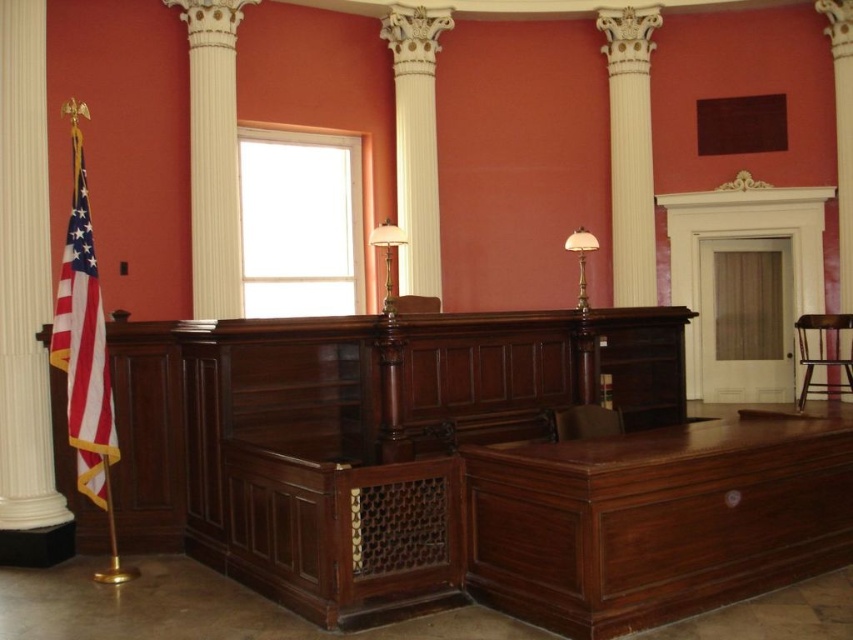
You are an architect examining the courtroom layout. You need to determine the order of objects from closest to farthest from your viewpoint. Which comes first between the white glossy column at upper left and the matte gold table lamp at center?

The white glossy column at upper left is closer to the viewer than the matte gold table lamp at center, so it comes first in the order from closest to farthest.

Based on the provided scene description, where is the white glossy column at upper left located in terms of coordinates?

The white glossy column at upper left is located at coordinates point (x=213, y=154).

You are an interior designer assessing the courtroom layout. You notice the translucent glass lamp at center and the mahogany wood chair at center. Which object occupies more space in the room?

The translucent glass lamp at center is larger in size than the mahogany wood chair at center, so it occupies more space in the room.